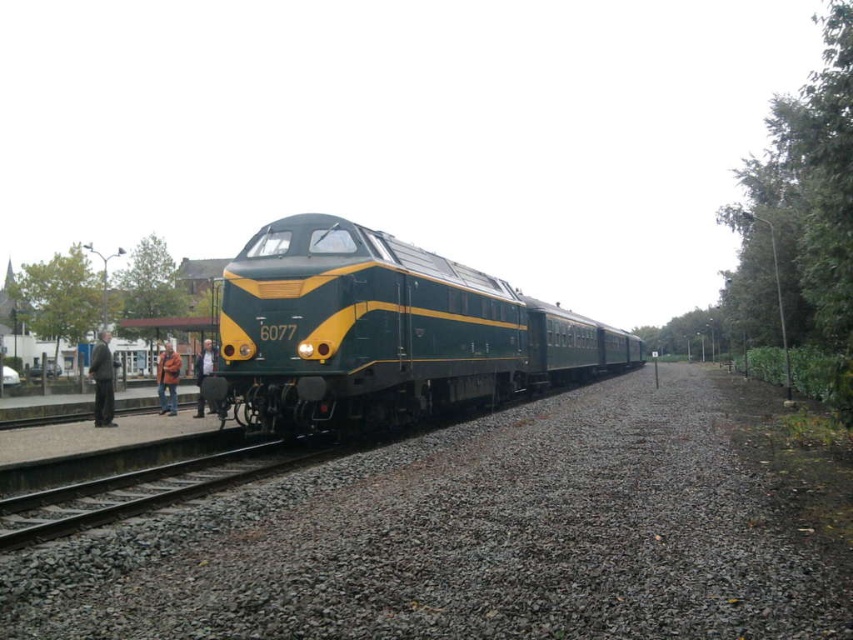
You are standing at the point marked as point (384, 332). Based on the scene description, what object are you currently standing on?

The point (384, 332) is on the green polished metal train at center, so you are standing on the green polished metal train at center.

You are standing at the point marked as point (97, 344) and want to walk to the platform on the left side. The path is along the gravelly embankment. If your walking speed is 1.5 m per second, how long will it take you to reach the platform?

The distance between point (97, 344) and the platform on the left side is 43.86 meters. At a walking speed of 1.5 m per second, it will take approximately 29.24 seconds to reach the platform.